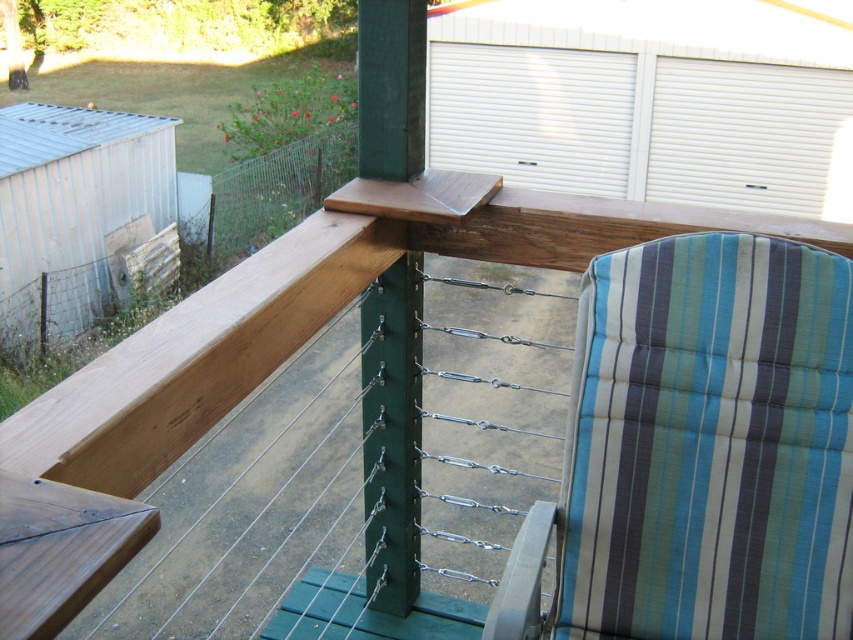
Who is more distant from viewer, [845,435] or [393,116]?

The point [393,116] is behind.

Does striped fabric beach chair at right appear on the left side of green matte pole at center?

No, striped fabric beach chair at right is not to the left of green matte pole at center.

Between point (634, 500) and point (387, 337), which one is positioned in front?

Point (634, 500)

Image resolution: width=853 pixels, height=640 pixels. Find the location of `striped fabric beach chair at right`. striped fabric beach chair at right is located at coordinates (700, 451).

Does wooden rail at upper center appear under green matte pole at center?

No.

Is wooden rail at upper center closer to camera compared to green matte pole at center?

That is True.

Locate an element on the screen. The height and width of the screenshot is (640, 853). wooden rail at upper center is located at coordinates (310, 314).

This screenshot has height=640, width=853. I want to click on wooden rail at upper center, so click(x=310, y=314).

Does striped fabric beach chair at right have a larger size compared to wooden rail at upper center?

No, striped fabric beach chair at right is not bigger than wooden rail at upper center.

Does striped fabric beach chair at right have a greater height compared to wooden rail at upper center?

Yes.

Between point (610, 460) and point (318, 280), which one is positioned in front?

Positioned in front is point (318, 280).

The image size is (853, 640). I want to click on striped fabric beach chair at right, so click(700, 451).